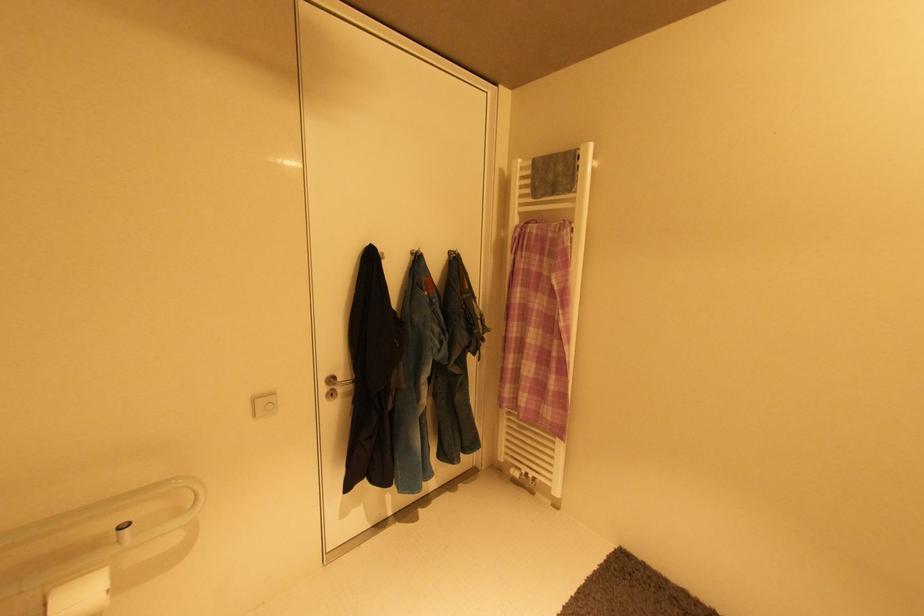
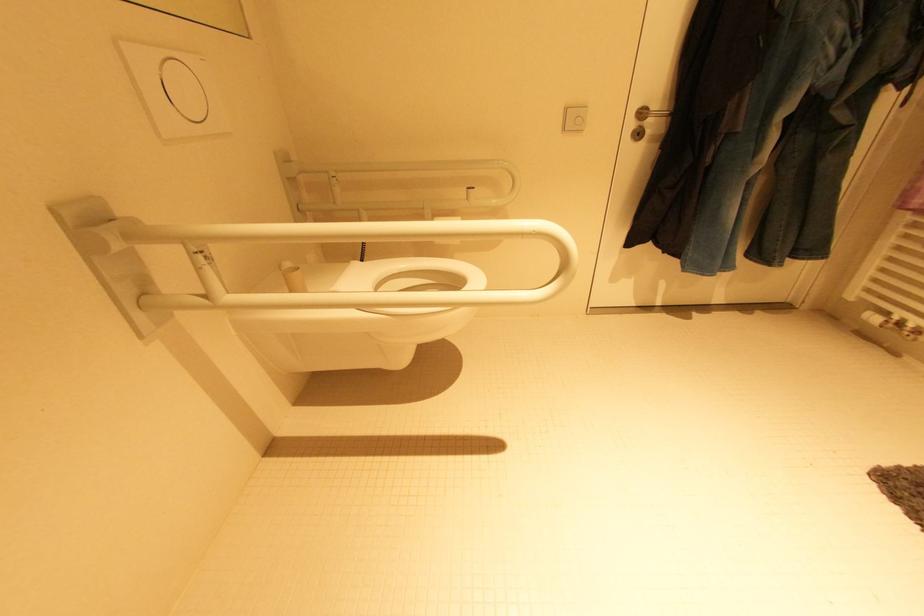
The first image is from the beginning of the video and the second image is from the end. How did the camera likely rotate when shooting the video?

The camera's rotation is toward left-down.